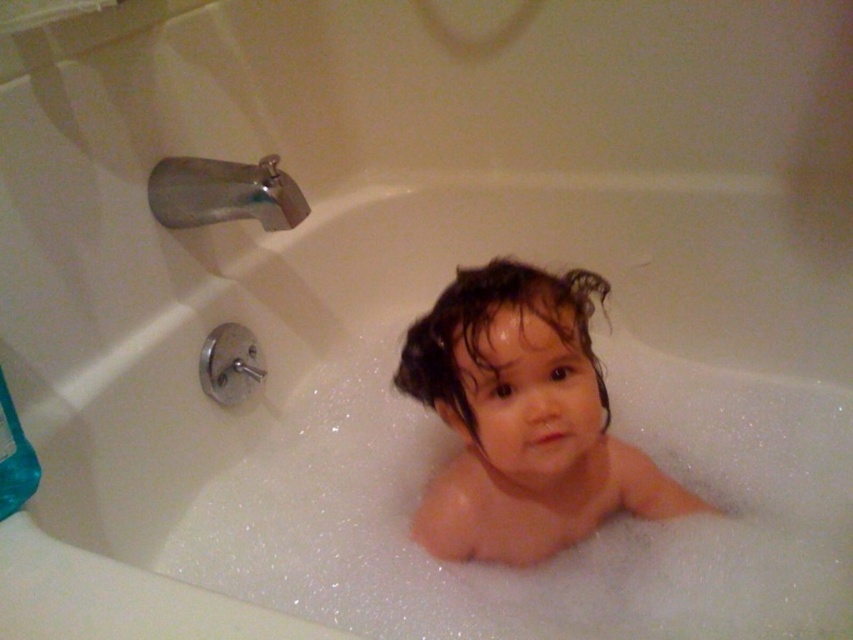
Question: Which point is closer to the camera?

Choices:
 (A) (577, 372)
 (B) (177, 225)

Answer: (A)

Question: Where is wet skin toddler at center located in relation to silver metallic faucet at upper left in the image?

Choices:
 (A) above
 (B) below

Answer: (B)

Question: Is wet skin toddler at center in front of silver metallic faucet at upper left?

Choices:
 (A) yes
 (B) no

Answer: (A)

Question: Which object appears closest to the camera in this image?

Choices:
 (A) silver metallic faucet at upper left
 (B) wet skin toddler at center

Answer: (B)

Question: Is wet skin toddler at center to the right of silver metallic faucet at upper left from the viewer's perspective?

Choices:
 (A) yes
 (B) no

Answer: (A)